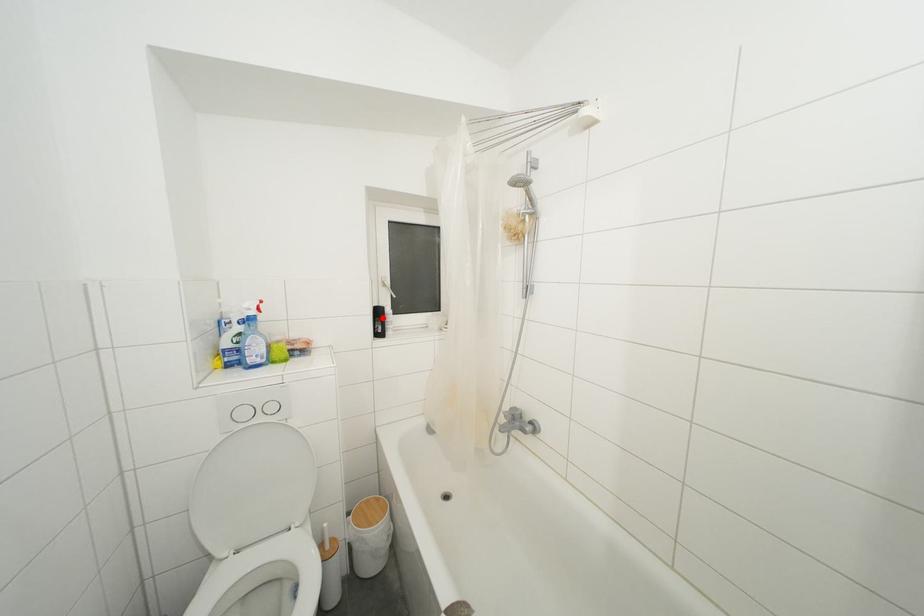
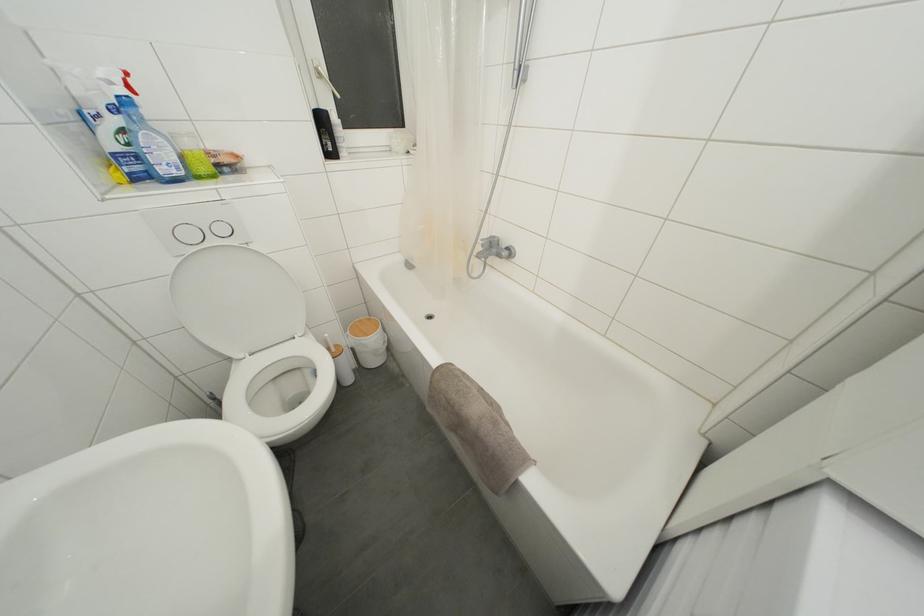
Question: A red point is marked in image1. In image2, is the corresponding 3D point closer to the camera or farther? Reply with the corresponding letter.

Choices:
 (A) The corresponding 3D point is closer.
 (B) The corresponding 3D point is farther.

Answer: (A)